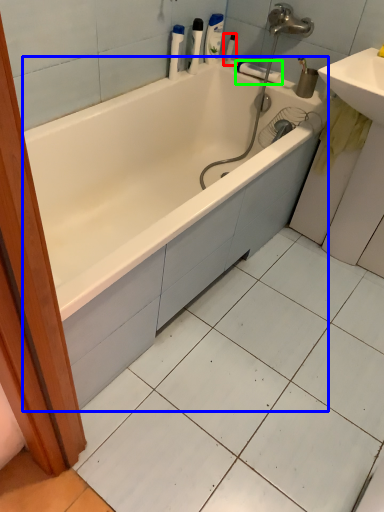
Question: Based on their relative distances, which object is nearer to toiletry (highlighted by a red box)? Choose from bathtub (highlighted by a blue box) and towel bar (highlighted by a green box).

Choices:
 (A) bathtub
 (B) towel bar

Answer: (B)